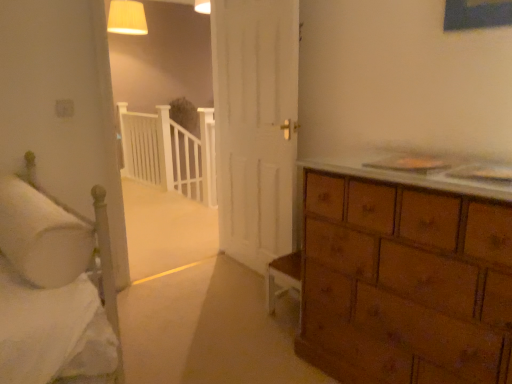
Question: From a real-world perspective, relative to white soft pillow at left, is matte cream lampshade at upper center vertically above or below?

Choices:
 (A) above
 (B) below

Answer: (A)

Question: In terms of size, does matte cream lampshade at upper center appear bigger or smaller than white soft pillow at left?

Choices:
 (A) small
 (B) big

Answer: (B)

Question: Which object is the closest to the white wooden balustrade at center?

Choices:
 (A) white soft pillow at left
 (B) matte cream lampshade at upper center

Answer: (B)

Question: Estimate the real-world distances between objects in this image. Which object is farther from the matte cream lampshade at upper center?

Choices:
 (A) white wooden balustrade at center
 (B) white soft pillow at left

Answer: (B)